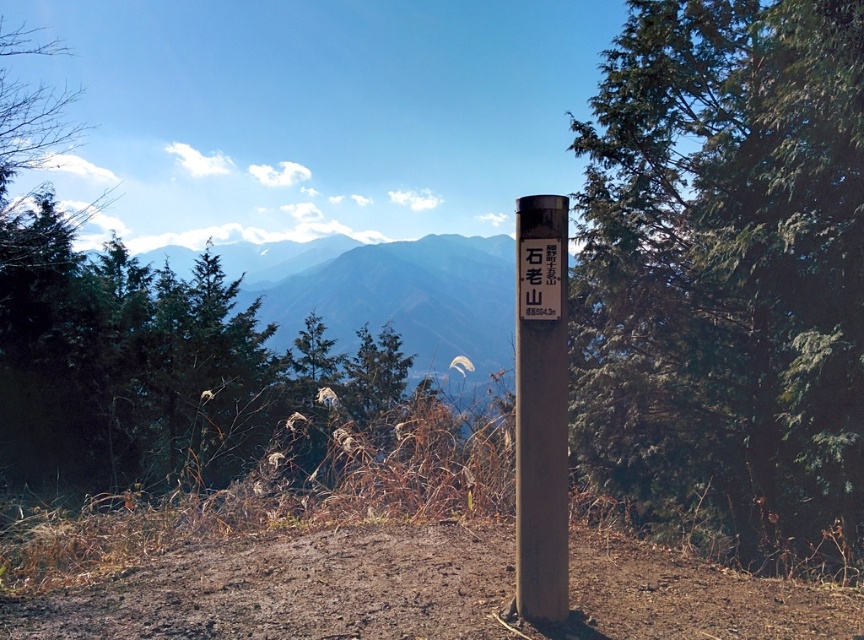
You are a hiker trying to read two signposts in the middle of the path. The smooth brown signpost at center and the matte black signpost at center. Which one is closer to you?

The smooth brown signpost at center is closer to you as it is in front of the matte black signpost at center.

Looking at this image, you are standing at the base of the brown cylindrical post with a signboard in the foreground of the image. Looking towards the center right, you see a green textured tree marked by point (726, 273). Is this tree closer to you than the mountain range in the background?

The point (726, 273) marks a green textured tree at center right, which is in the midground between the foreground post and the background mountain range. Since the midground trees are closer than the distant mountains, the tree is closer to you than the mountain range.

You are a hiker trying to read the signpost in the scene. Can you see the smooth brown signpost at center clearly from your current position, considering the green textured tree at center right?

The smooth brown signpost at center is behind the green textured tree at center right, so it might be partially or fully obstructed by the tree, making it difficult to see clearly.